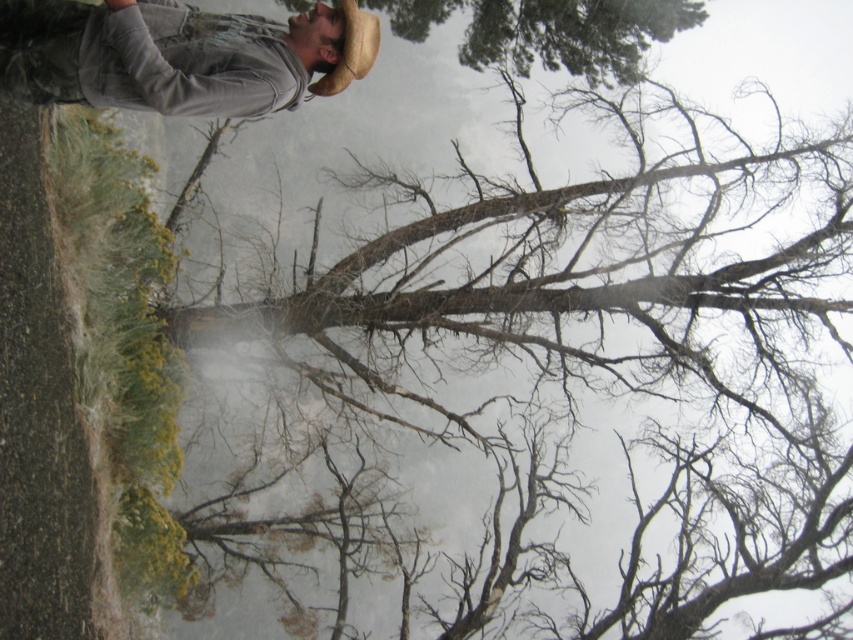
Question: Which object is the closest to the braided straw cowboy hat at upper center?

Choices:
 (A) bare branches at upper center
 (B) gray fabric jacket at upper left

Answer: (B)

Question: Can you confirm if bare branches at upper center is positioned to the left of gray fabric jacket at upper left?

Choices:
 (A) no
 (B) yes

Answer: (A)

Question: Is gray fabric jacket at upper left to the left of braided straw cowboy hat at upper center from the viewer's perspective?

Choices:
 (A) yes
 (B) no

Answer: (A)

Question: Which point appears farthest from the camera in this image?

Choices:
 (A) (850, 259)
 (B) (84, 54)

Answer: (A)

Question: Which point is closer to the camera?

Choices:
 (A) [677, 179]
 (B) [314, 17]

Answer: (B)

Question: Does bare branches at upper center appear on the right side of gray fabric jacket at upper left?

Choices:
 (A) no
 (B) yes

Answer: (B)